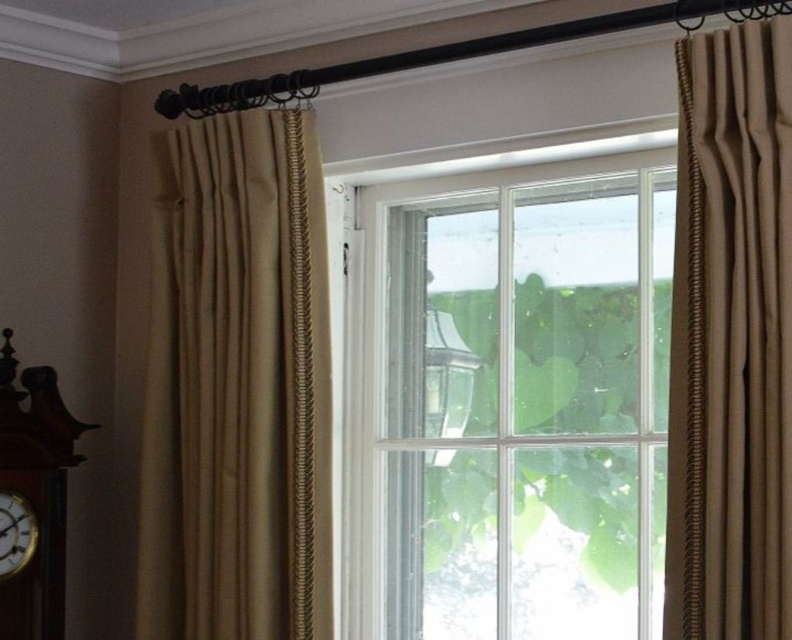
You are an interior designer assessing the room layout. You need to determine if the beige textured curtain at right can be moved to cover the clear glass lamp at center without overlapping. Can you confirm if the curtain is wider than the lamp?

The beige textured curtain at right is wider than the clear glass lamp at center, so yes, it can be moved to cover the lamp without overlapping.

You are standing in the room and want to move from point A to point B. Point A is at point [693,628] and point B is at point [440,433]. According to the scene, which point is closer to you when you are facing the window?

Point [693,628] is closer to you because it is in front of point [440,433].

You are arranging furniture in this room and need to place a large decorative item between the clear glass lamp at center and the wooden clock at lower left. Given their sizes, which item would you choose to place closer to the smaller object?

The wooden clock at lower left is smaller than the clear glass lamp at center, so you should place the large decorative item closer to the wooden clock at lower left to maintain balance.